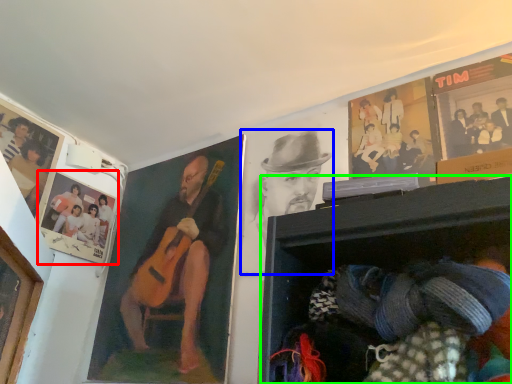
Question: Estimate the real-world distances between objects in this image. Which object is farther from picture frame (highlighted by a red box), man (highlighted by a blue box) or shelf (highlighted by a green box)?

Choices:
 (A) man
 (B) shelf

Answer: (B)